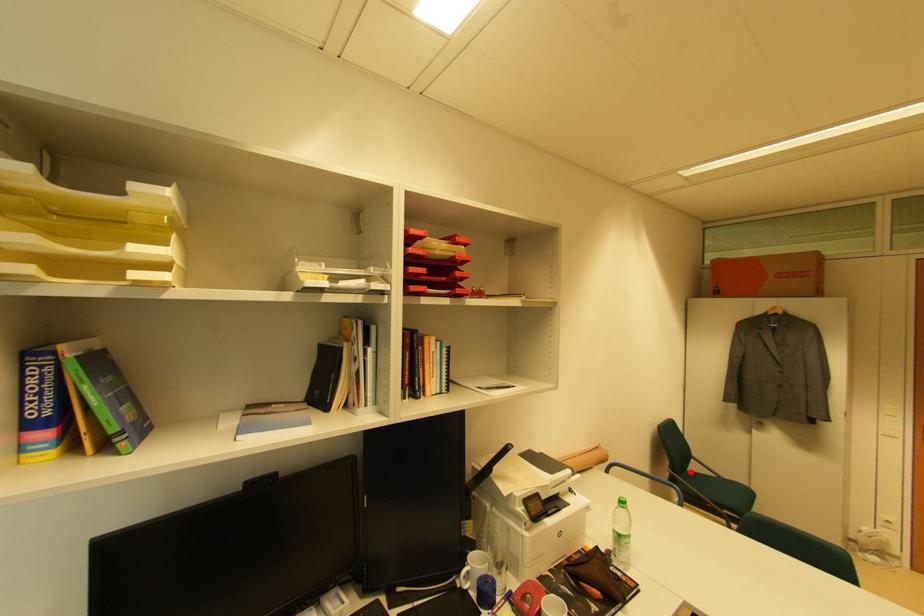
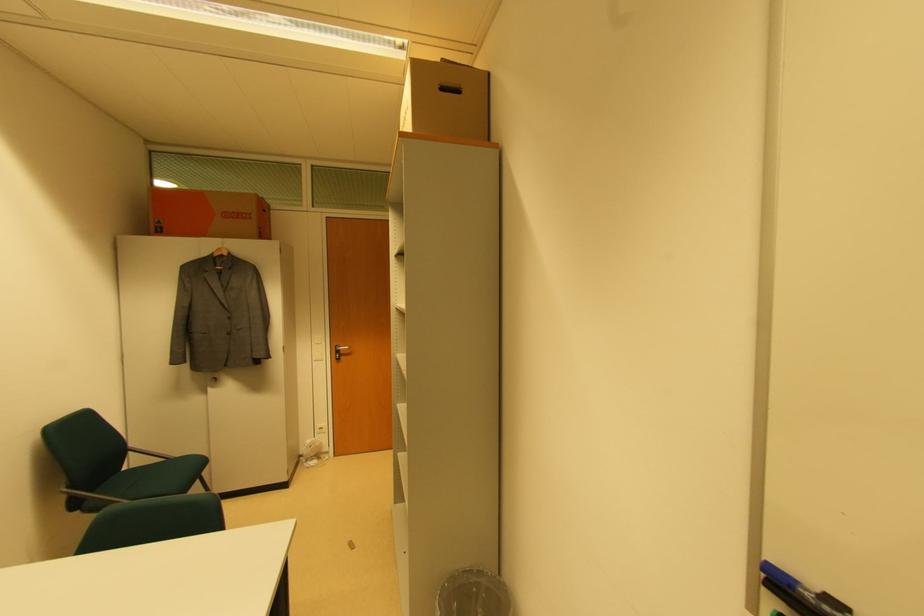
The point at the highlighted location is marked in the first image. Where is the corresponding point in the second image?

(126, 471)